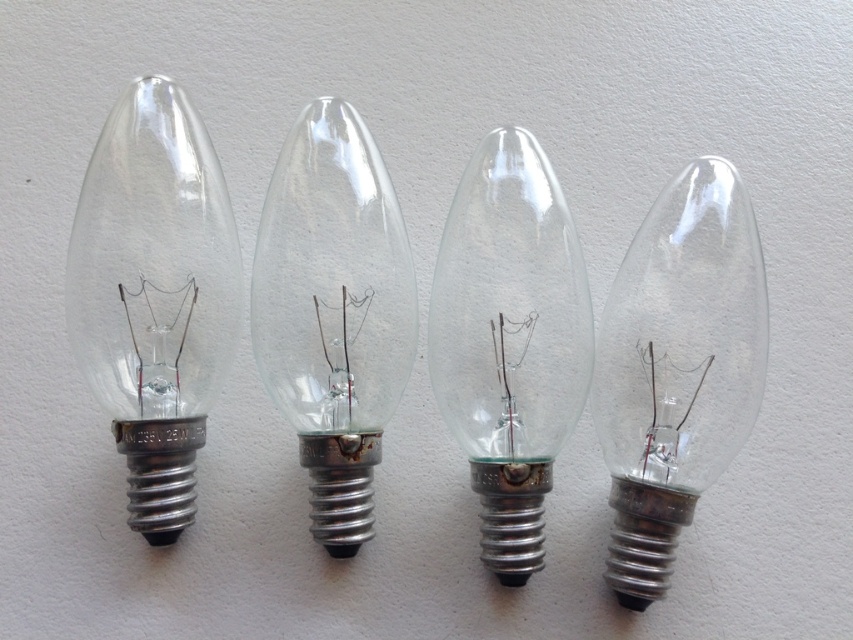
Can you confirm if transparent glass light bulb at center is positioned below clear glass bulb at center?

Actually, transparent glass light bulb at center is above clear glass bulb at center.

Is point (369, 250) farther from camera compared to point (496, 227)?

Yes.

Between point (270, 330) and point (537, 307), which one is positioned in front?

Point (537, 307)

At what (x,y) coordinates should I click in order to perform the action: click on transparent glass light bulb at center. Please return your answer as a coordinate pair (x, y). The height and width of the screenshot is (640, 853). Looking at the image, I should click on (334, 310).

Is transparent glass light bulb at left above transparent glass light bulb at center?

Correct, transparent glass light bulb at left is located above transparent glass light bulb at center.

Is transparent glass light bulb at left further to the viewer compared to transparent glass light bulb at center?

That is False.

Which is behind, point (195, 346) or point (289, 216)?

The point (289, 216) is more distant.

At what (x,y) coordinates should I click in order to perform the action: click on transparent glass light bulb at left. Please return your answer as a coordinate pair (x, y). The height and width of the screenshot is (640, 853). Looking at the image, I should click on tap(154, 292).

Can you confirm if transparent glass bulb at right is smaller than transparent glass light bulb at center?

No.

Who is positioned more to the left, transparent glass bulb at right or transparent glass light bulb at center?

transparent glass light bulb at center

Who is more distant from viewer, (738, 346) or (358, 211)?

Point (358, 211)

Identify the location of transparent glass bulb at right. (677, 368).